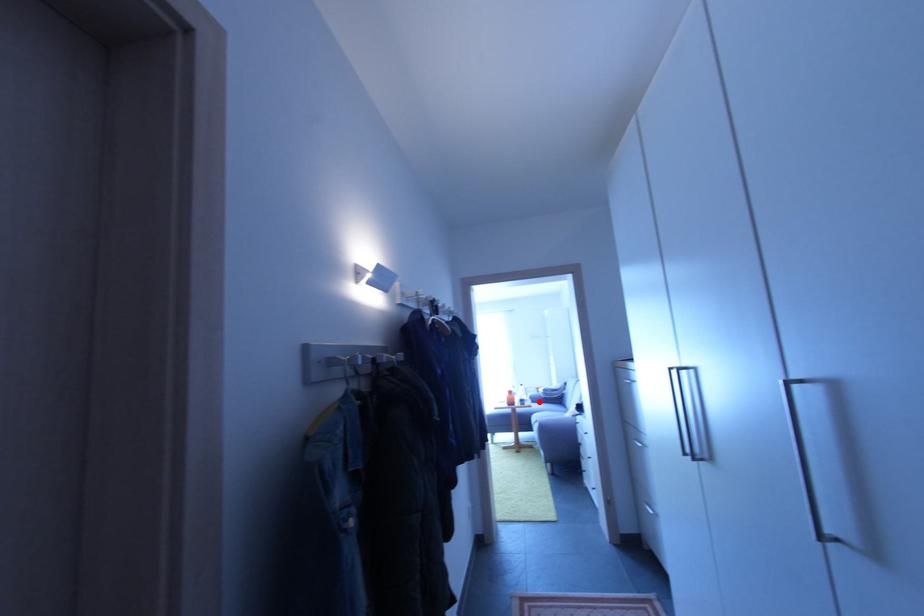
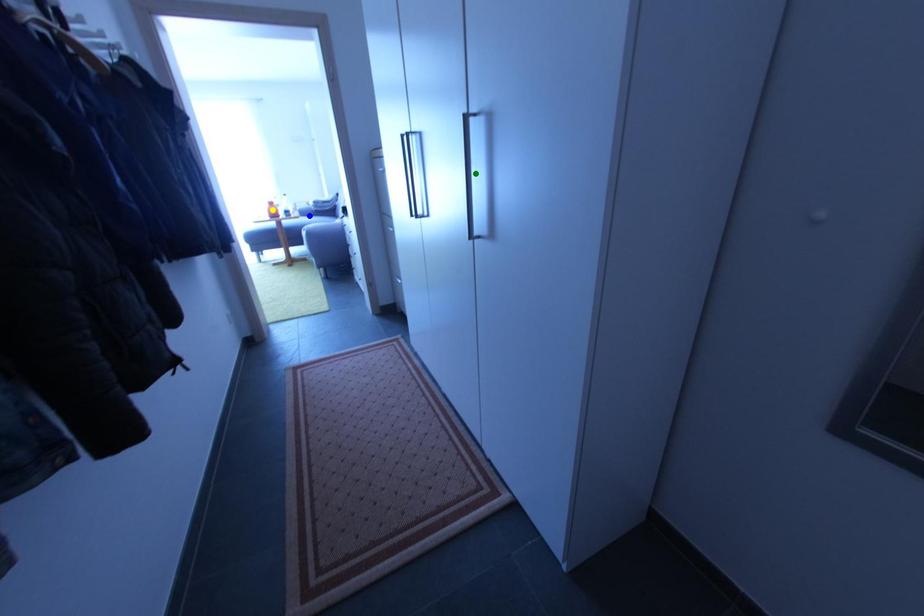
Question: I am providing you with two images of the same scene from different viewpoints. A red point is marked on the first image. You are given multiple points on the second image. Which mark in image 2 goes with the point in image 1?

Choices:
 (A) green point
 (B) blue point
 (C) yellow point

Answer: (B)